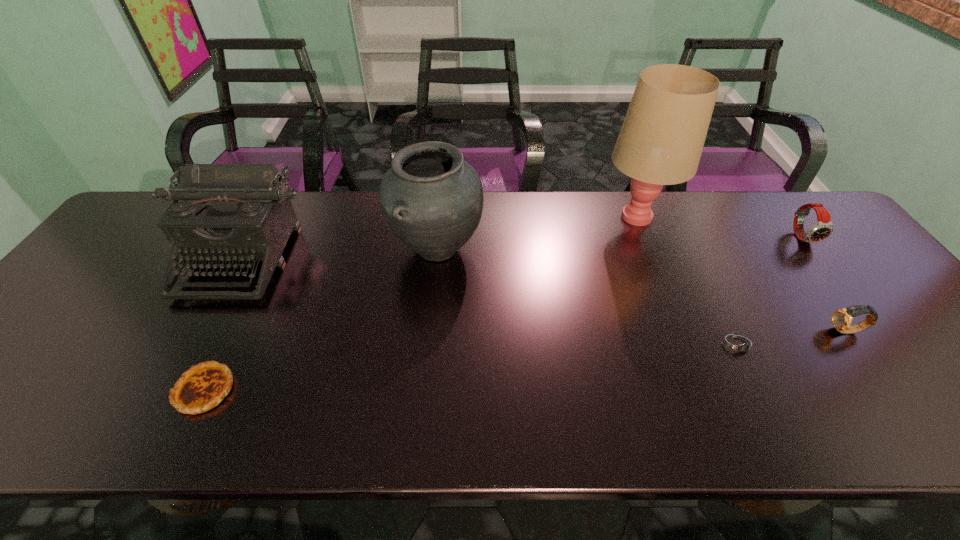
Locate an element on the screen. free space located on the right of the lampshade is located at coordinates (690, 215).

You are a GUI agent. You are given a task and a screenshot of the screen. Output one action in this format:
    pyautogui.click(x=<x>, y=<y>)
    Task: Click on the vacant space located 0.360m on the front of the sixth shortest object
    The height and width of the screenshot is (540, 960).
    Given the screenshot: What is the action you would take?
    pyautogui.click(x=420, y=413)

Locate an element on the screen. This screenshot has height=540, width=960. vacant space located 0.240m on the typing side of the third tallest object is located at coordinates (167, 390).

At what (x,y) coordinates should I click in order to perform the action: click on free space located on the face of the tallest watch. Please return your answer as a coordinate pair (x, y). Looking at the image, I should click on (855, 306).

Find the location of a particular element. The height and width of the screenshot is (540, 960). vacant space positioned 0.200m on the face of the second tallest watch is located at coordinates (745, 331).

At what (x,y) coordinates should I click in order to perform the action: click on free point located on the face of the second tallest watch. Please return your answer as a coordinate pair (x, y). Looking at the image, I should click on (682, 331).

This screenshot has width=960, height=540. In order to click on vacant region located on the face of the second tallest watch in this screenshot , I will do `click(796, 331)`.

Locate an element on the screen. The image size is (960, 540). free point located 0.100m on the back of the quiche is located at coordinates (234, 329).

Identify the location of vacant area located on the face of the shortest object. This screenshot has width=960, height=540. (774, 414).

Where is `lampshade situated at the far edge`? This screenshot has height=540, width=960. lampshade situated at the far edge is located at coordinates (660, 143).